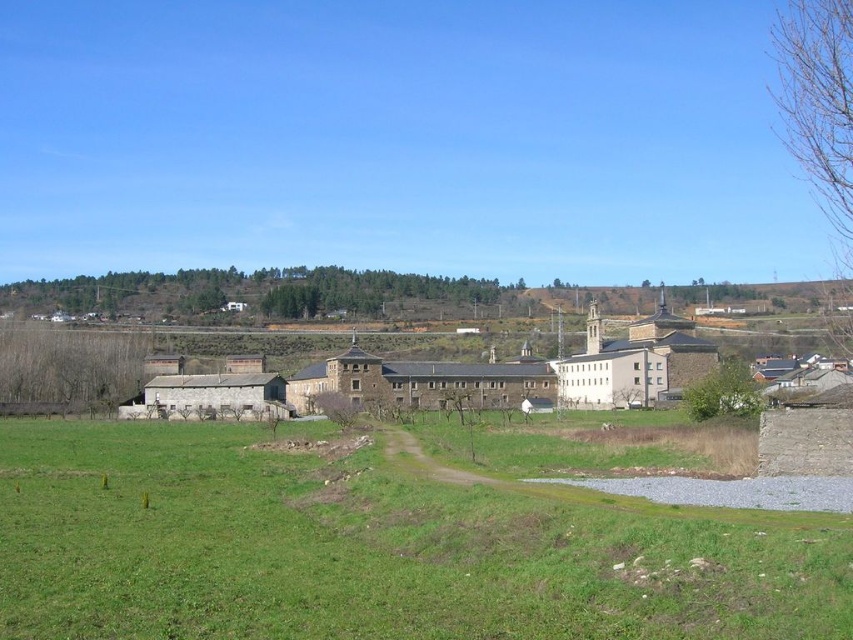
You are standing at the point marked as point (374, 548) in the image. Looking around, what type of terrain are you currently standing on?

The point (374, 548) is on green grass at lower left, so you are standing on green grass.

You are standing at the center of the image and want to walk to the point where the green grass at lower left is located. In which direction should you move?

You should move towards the lower left direction to reach the green grass at lower left, as it is located at point [374,548].

You are standing at the dirt path in the foreground of the rural landscape. You see two points marked in the image. Which point, point (123, 500) or point (277, 404), is closer to you?

Point (123, 500) is closer to the viewer than point (277, 404).